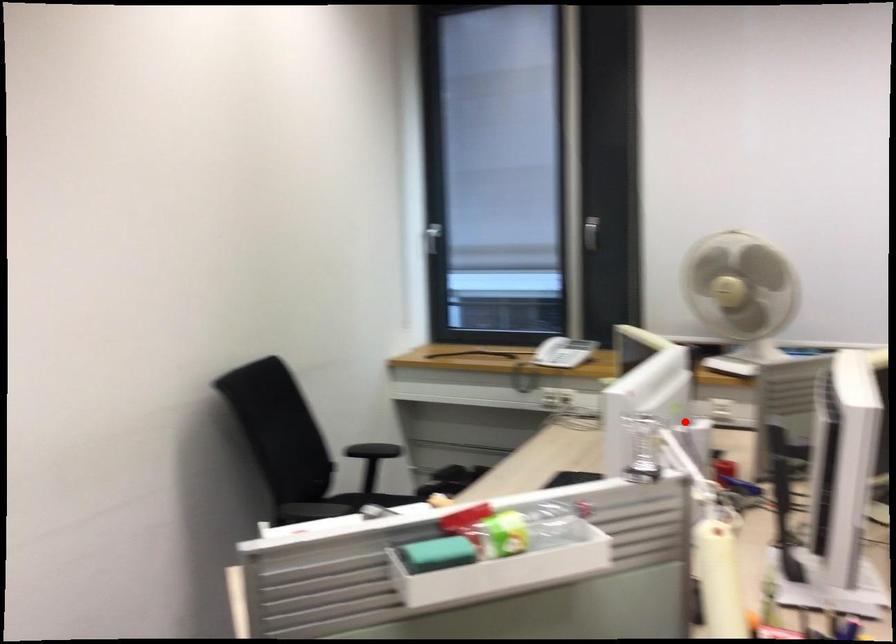
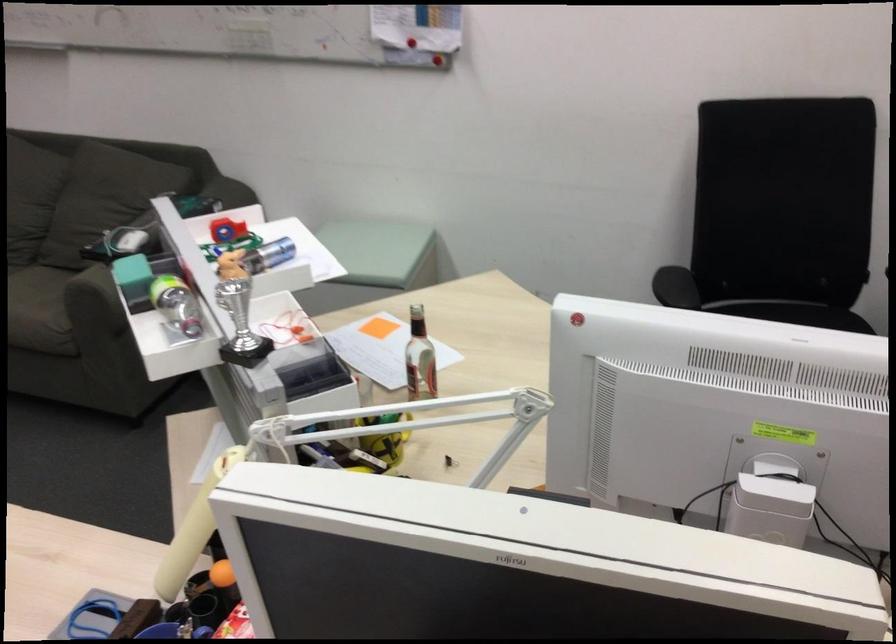
The point at the highlighted location is marked in the first image. Where is the corresponding point in the second image?

(770, 509)